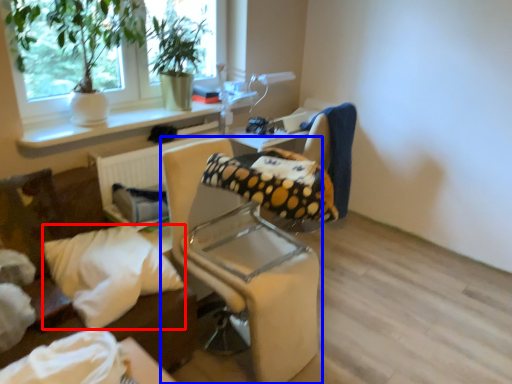
Question: Which object is closer to the camera taking this photo, pillow (highlighted by a red box) or chair (highlighted by a blue box)?

Choices:
 (A) pillow
 (B) chair

Answer: (B)